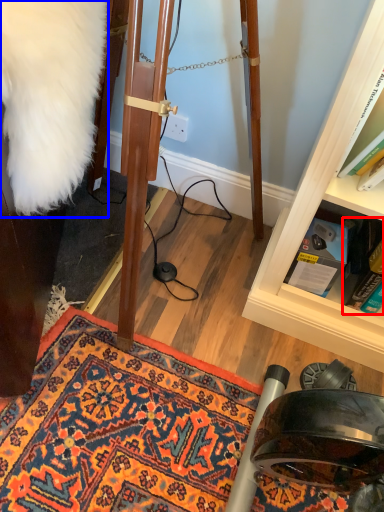
Question: Which point is further to the camera, book (highlighted by a red box) or fur coat (highlighted by a blue box)?

Choices:
 (A) book
 (B) fur coat

Answer: (A)